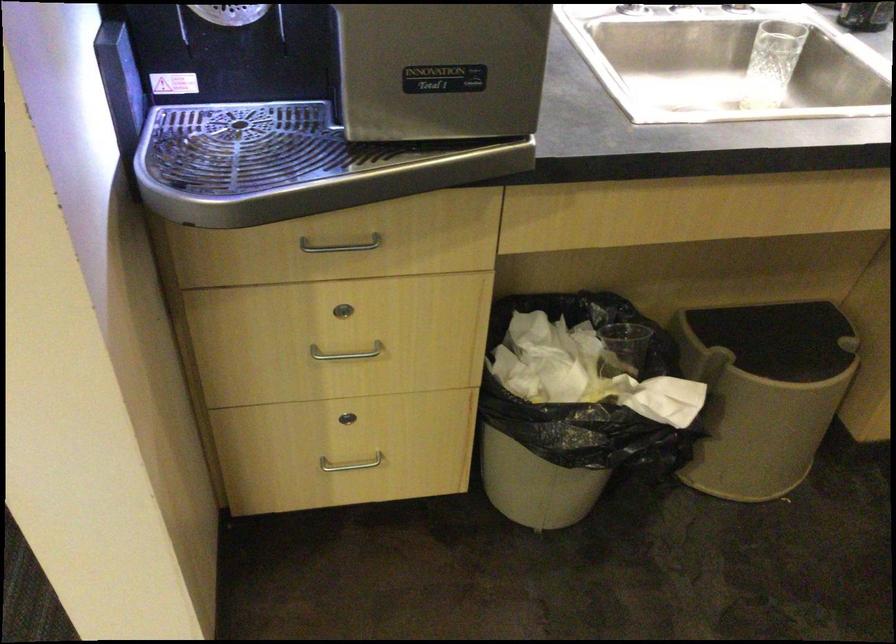
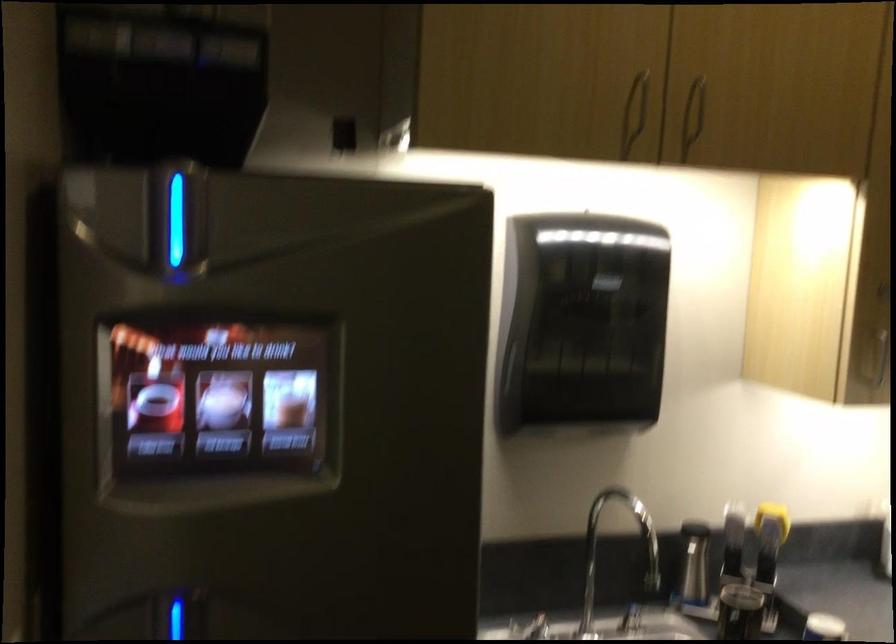
Question: How did the camera likely rotate?

Choices:
 (A) Left
 (B) Right
 (C) Up
 (D) Down

Answer: (C)